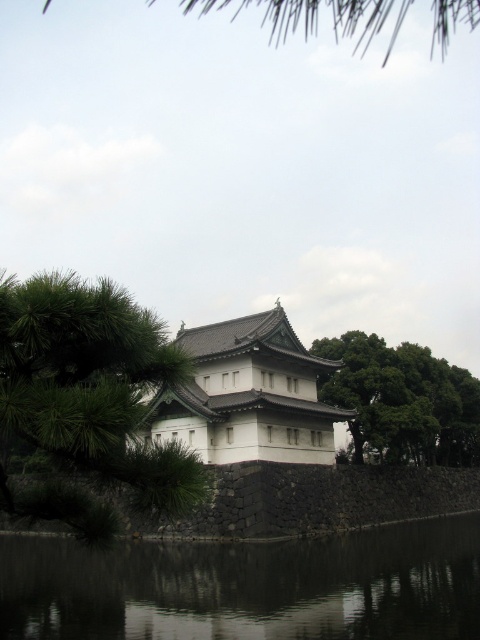
Question: Is the position of green leafy tree at left more distant than that of white matte/stone building at center?

Choices:
 (A) no
 (B) yes

Answer: (A)

Question: Is green leafy tree at left thinner than white matte/stone building at center?

Choices:
 (A) no
 (B) yes

Answer: (A)

Question: Among these objects, which one is nearest to the camera?

Choices:
 (A) green leafy tree at center
 (B) black reflective water at lower center
 (C) white matte/stone building at center
 (D) green leafy tree at left

Answer: (D)

Question: Which object appears farthest from the camera in this image?

Choices:
 (A) white matte/stone building at center
 (B) green leafy tree at left
 (C) black reflective water at lower center

Answer: (A)

Question: Which point is closer to the camera taking this photo?

Choices:
 (A) (303, 572)
 (B) (144, 339)
 (C) (276, 435)
 (D) (457, 392)

Answer: (B)

Question: Does white matte/stone building at center appear over green leafy tree at center?

Choices:
 (A) yes
 (B) no

Answer: (A)